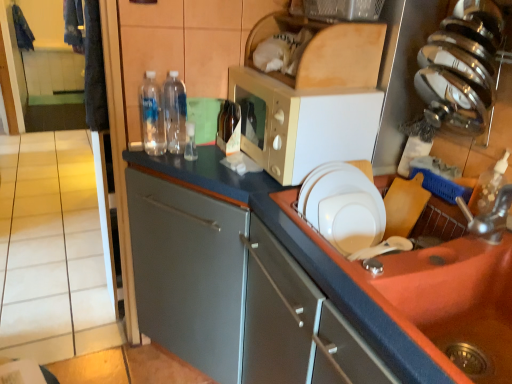
At what (x,y) coordinates should I click in order to perform the action: click on free spot to the right of transparent plastic bottle at center, the 2th bottle when ordered from left to right. Please return your answer as a coordinate pair (x, y). Looking at the image, I should click on (205, 156).